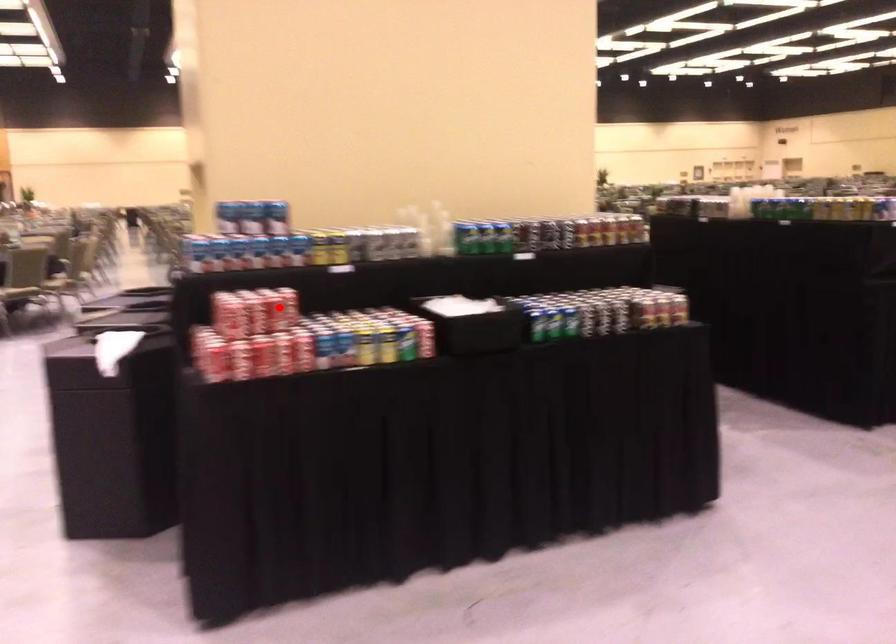
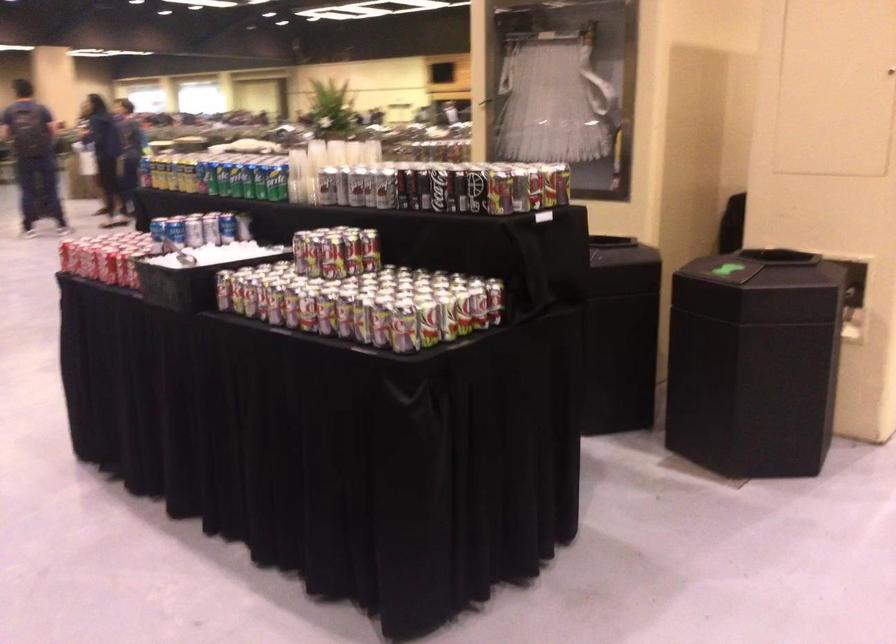
Question: I am providing you with two images of the same scene from different viewpoints. A red point is marked on the first image. At the location where the point appears in image 1, is it still visible in image 2?

Choices:
 (A) Yes
 (B) No

Answer: (B)